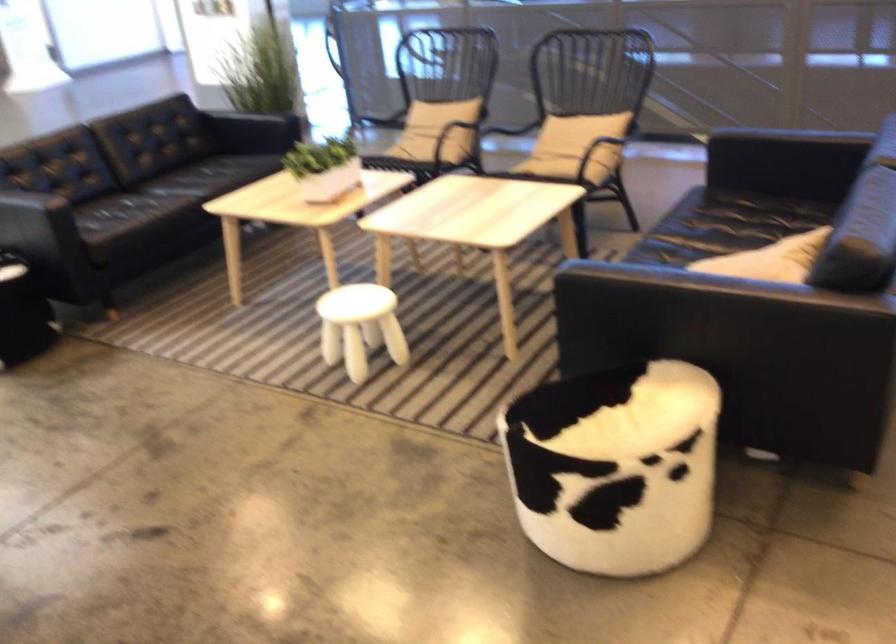
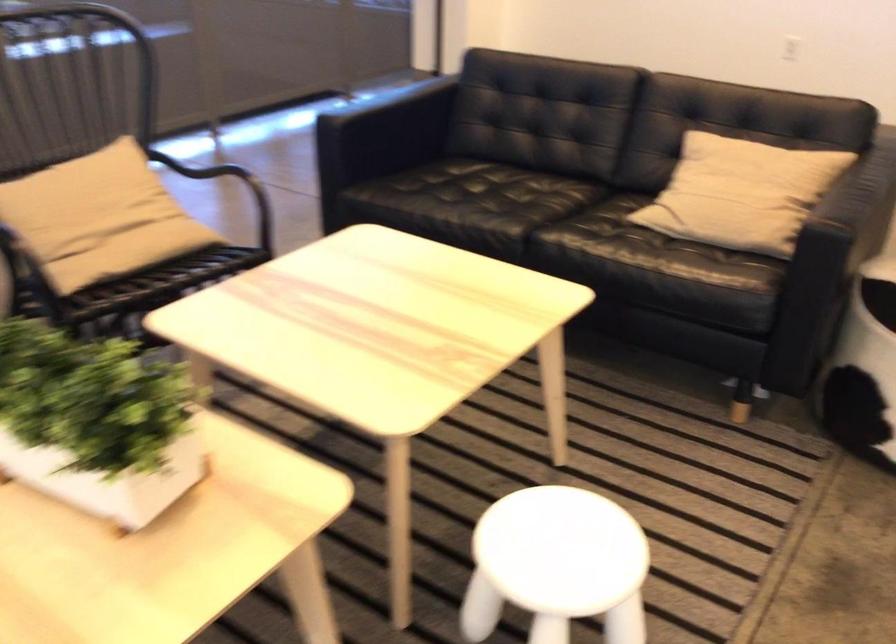
The point at (725, 270) is marked in the first image. Where is the corresponding point in the second image?

(741, 193)